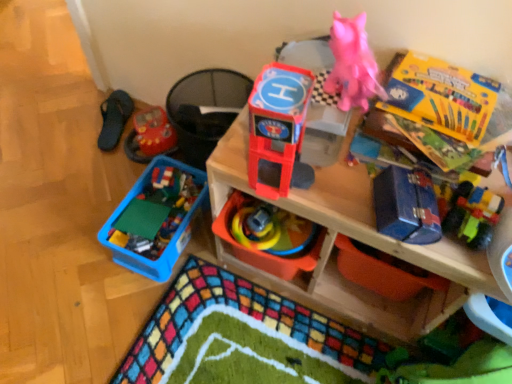
Where is `empty space that is to the right of shiny plastic toy helicopter at center, which ranks as the first toy in front-to-back order`? The image size is (512, 384). empty space that is to the right of shiny plastic toy helicopter at center, which ranks as the first toy in front-to-back order is located at coordinates (333, 196).